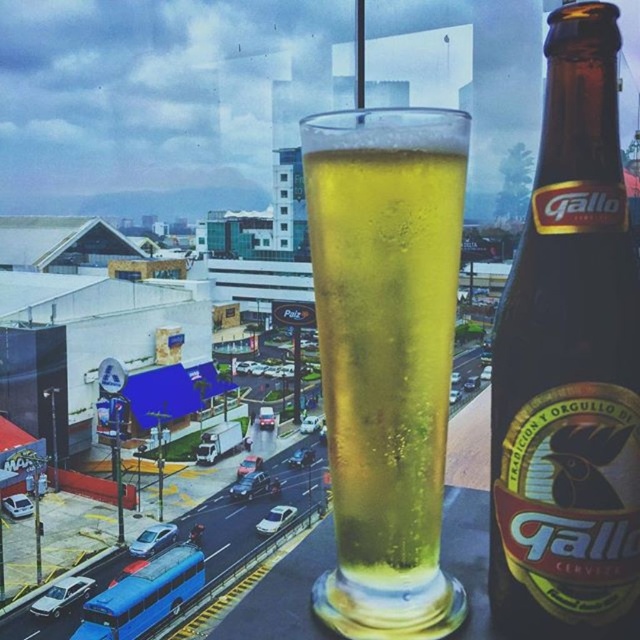
Can you confirm if brown glass bottle at center is thinner than translucent glass at center?

Yes.

Which is more to the right, brown glass bottle at center or translucent glass at center?

From the viewer's perspective, brown glass bottle at center appears more on the right side.

Locate an element on the screen. Image resolution: width=640 pixels, height=640 pixels. brown glass bottle at center is located at coordinates (570, 365).